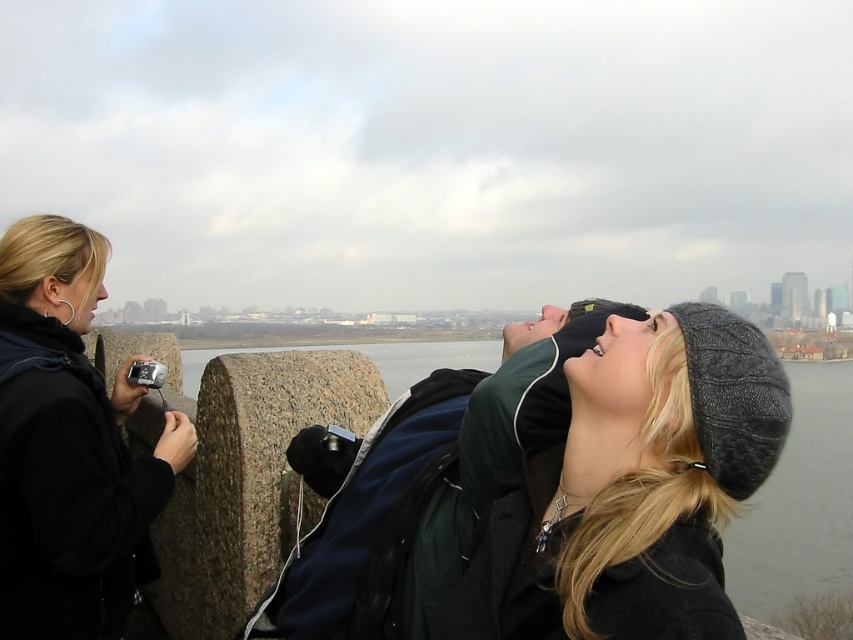
Measure the distance between point [519,442] and camera.

Point [519,442] and camera are 101.44 feet apart from each other.

Who is higher up, dark green jacket at center or black fabric camera at left?

Positioned higher is black fabric camera at left.

Image resolution: width=853 pixels, height=640 pixels. Find the location of `dark green jacket at center`. dark green jacket at center is located at coordinates (419, 488).

At what (x,y) coordinates should I click in order to perform the action: click on dark green jacket at center. Please return your answer as a coordinate pair (x, y). Looking at the image, I should click on (419, 488).

Describe the element at coordinates (634, 490) in the screenshot. I see `dark gray knit hat at upper right` at that location.

You are a GUI agent. You are given a task and a screenshot of the screen. Output one action in this format:
    pyautogui.click(x=<x>, y=<y>)
    Task: Click on the dark gray knit hat at upper right
    This screenshot has height=640, width=853.
    Given the screenshot: What is the action you would take?
    pyautogui.click(x=634, y=490)

This screenshot has width=853, height=640. Find the location of `dark gray knit hat at upper right`. dark gray knit hat at upper right is located at coordinates (634, 490).

Between point (734, 397) and point (45, 256), which one is positioned behind?

The point (45, 256) is more distant.

Can you confirm if dark gray knit hat at upper right is positioned below black fabric camera at left?

Yes.

Does point (769, 448) come closer to viewer compared to point (48, 364)?

That is True.

Identify the location of dark gray knit hat at upper right. This screenshot has height=640, width=853. (634, 490).